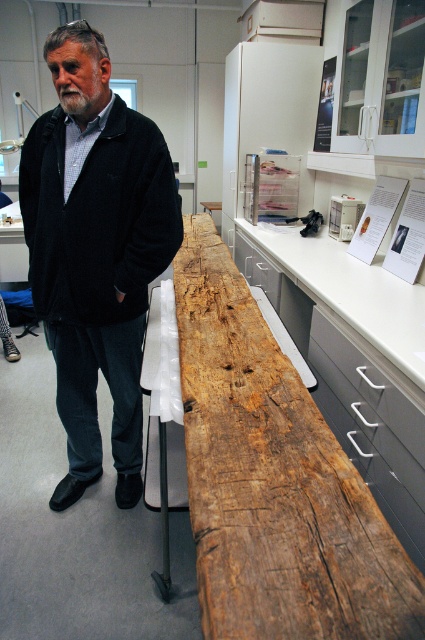
You are a visitor in the laboratory and notice the black woolen sweater at center and the white smooth countertop at center. Which object is located to the left when viewed from your perspective?

The black woolen sweater at center is positioned on the left side of the white smooth countertop at center, so it is located to the left.

You are a researcher who needs to place a 50 cm long tool on the surface between the weathered wood beam at center and the white smooth countertop at center. Can the tool fit in the space between them?

The distance between the weathered wood beam at center and the white smooth countertop at center is 48.70 centimeters. Since the tool is 50 cm long, it will not fit in the space between them as the distance is shorter than the tool.